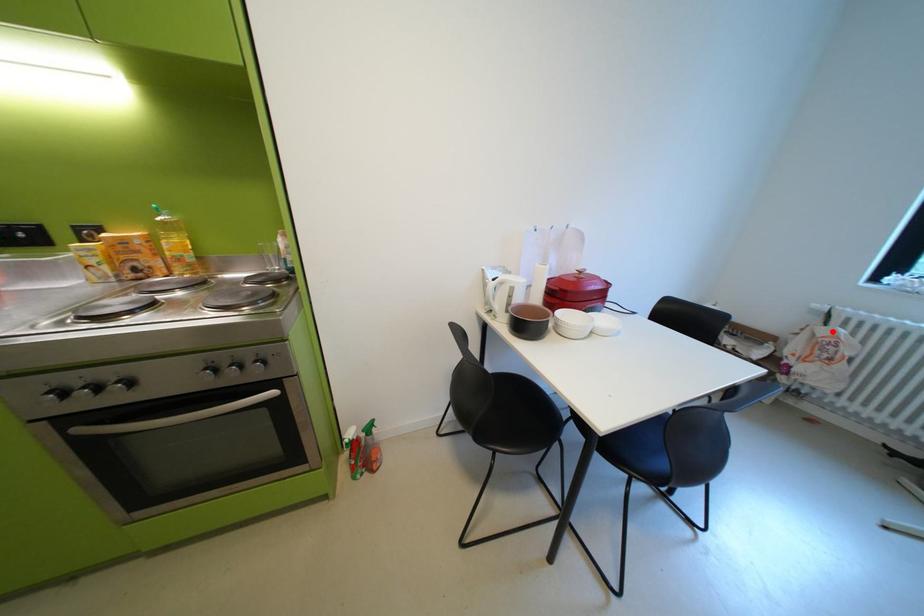
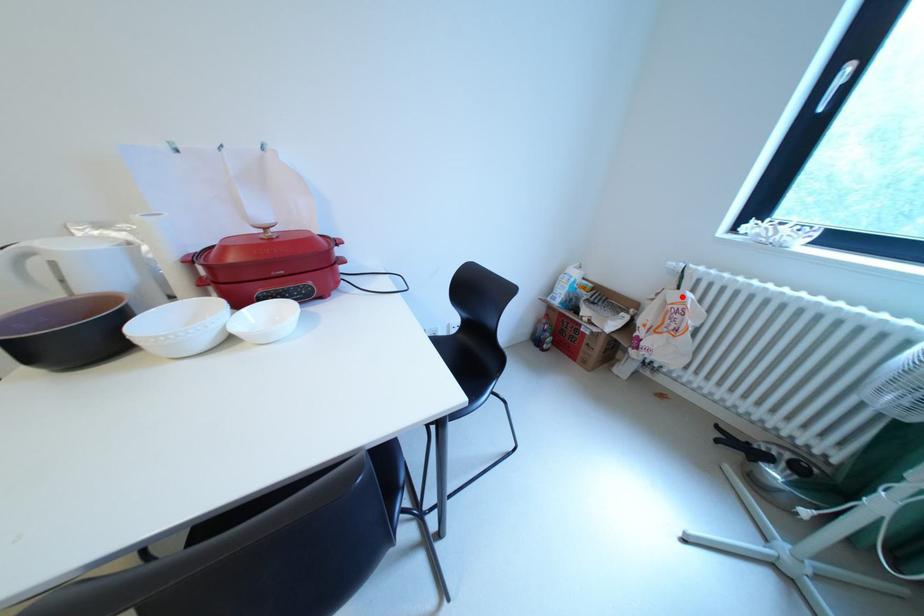
I am providing you with two images of the same scene from different viewpoints. A red point is marked on the first image and another point is marked on the second image. Is the marked point in image1 the same physical position as the marked point in image2?

Yes